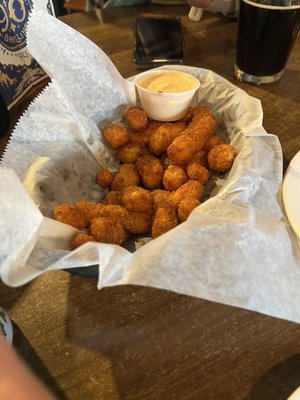
In order to click on plate in this screenshot , I will do `click(292, 196)`.